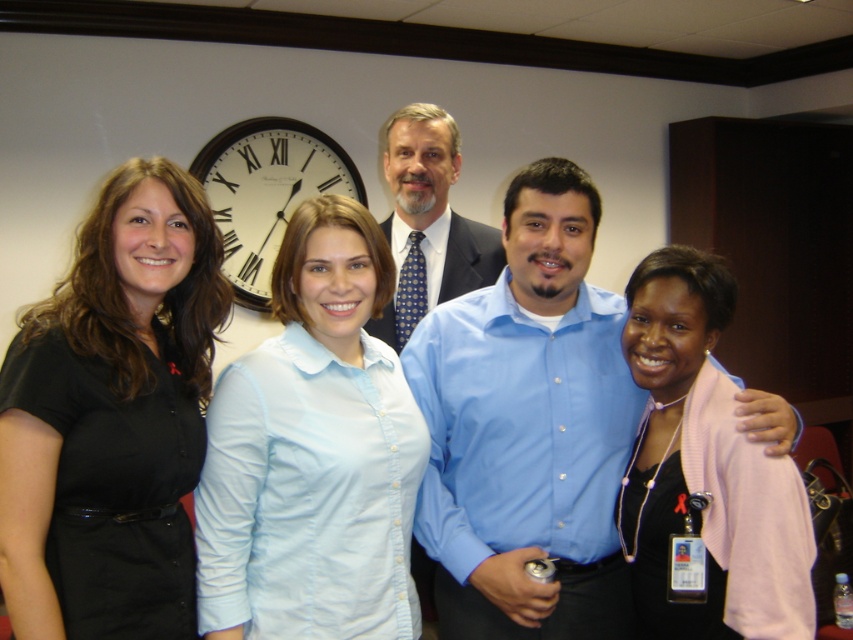
Can you confirm if blue button-down shirt at center is bigger than light blue button-down shirt at center?

Yes, blue button-down shirt at center is bigger than light blue button-down shirt at center.

Who is positioned more to the left, blue button-down shirt at center or light blue button-down shirt at center?

light blue button-down shirt at center

Describe the element at coordinates (527, 428) in the screenshot. I see `blue button-down shirt at center` at that location.

What are the coordinates of `blue button-down shirt at center` in the screenshot? It's located at coord(527,428).

Which is more to the left, light blue button-down shirt at center or blue shirt at center?

light blue button-down shirt at center

Who is shorter, light blue button-down shirt at center or blue shirt at center?

Standing shorter between the two is blue shirt at center.

Which is in front, point (363, 376) or point (432, 109)?

Point (363, 376) is more forward.

You are a GUI agent. You are given a task and a screenshot of the screen. Output one action in this format:
    pyautogui.click(x=<x>, y=<y>)
    Task: Click on the light blue button-down shirt at center
    This screenshot has height=640, width=853.
    Given the screenshot: What is the action you would take?
    pyautogui.click(x=312, y=452)

Does blue button-down shirt at center have a smaller size compared to black shirt at left?

Incorrect, blue button-down shirt at center is not smaller in size than black shirt at left.

Can you confirm if blue button-down shirt at center is bigger than black shirt at left?

A: Indeed, blue button-down shirt at center has a larger size compared to black shirt at left.

Locate an element on the screen. The height and width of the screenshot is (640, 853). blue button-down shirt at center is located at coordinates (527, 428).